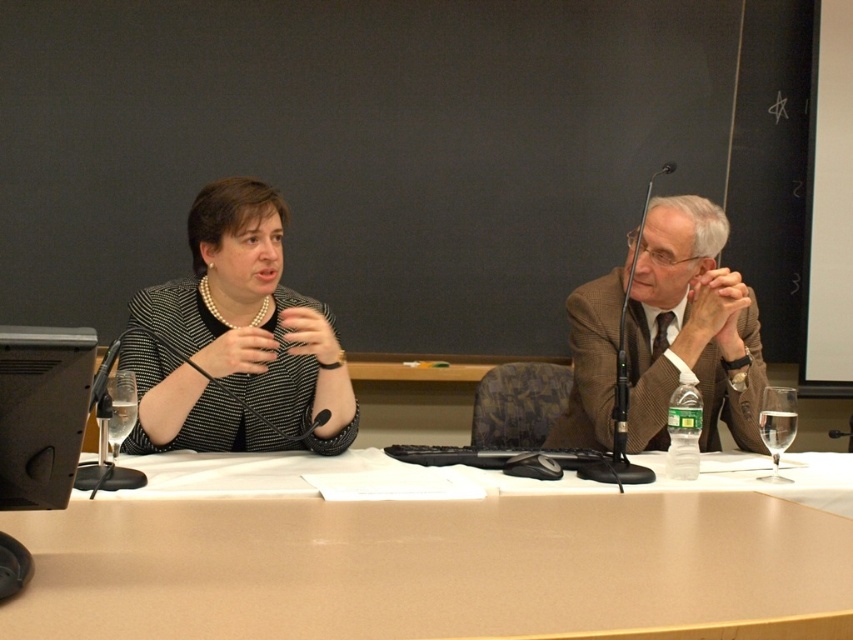
What are the coordinates of the brown wooden table at center?

The brown wooden table at center is located at coordinates point (x=436, y=568).

You are organizing a photoshoot and need to ensure that the clothing items from the scene are displayed in order of their widths. Given the black textured blazer at left and the brown textured suit at right, which one should be placed first if arranging from narrowest to widest?

The black textured blazer at left should be placed first since its width is narrower than the brown textured suit at right.

You are a photographer positioned behind the table. You need to adjust your camera to focus on both the brown wooden table at center and the brown textured suit at right. Which object should you focus on first to ensure proper depth of field?

The brown wooden table at center is below the brown textured suit at right, so you should focus on the brown wooden table at center first to ensure proper depth of field.